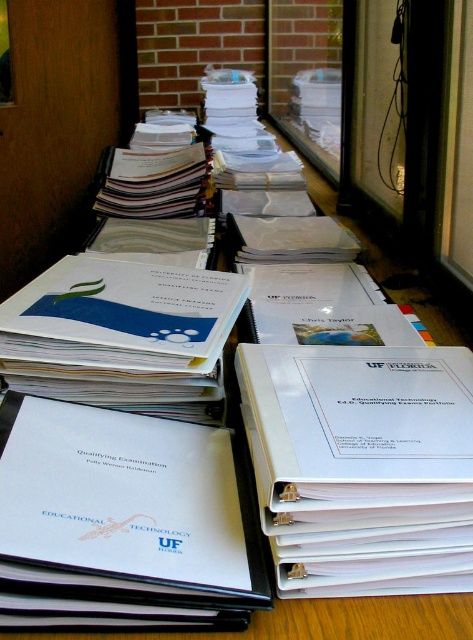
Is point (177, 556) more distant than point (271, 449)?

That is False.

Is white matte binder at center further to camera compared to white plastic binder at center?

No, it is not.

You are a GUI agent. You are given a task and a screenshot of the screen. Output one action in this format:
    pyautogui.click(x=<x>, y=<y>)
    Task: Click on the white matte binder at center
    This screenshot has width=473, height=640.
    Given the screenshot: What is the action you would take?
    pyautogui.click(x=122, y=522)

This screenshot has width=473, height=640. I want to click on white matte binder at center, so click(122, 522).